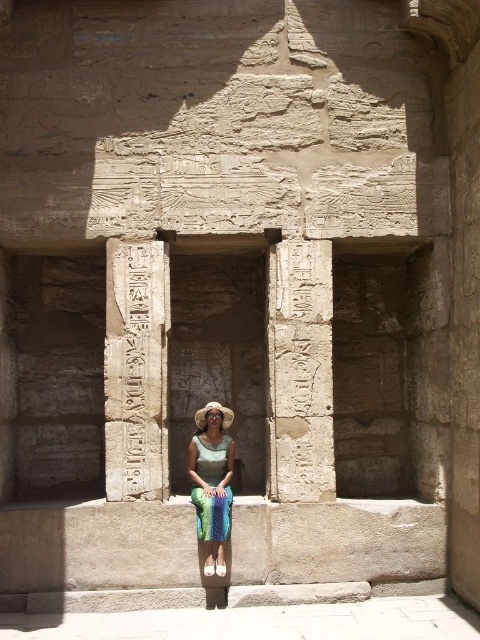
Which is above, white stone hieroglyphics at center or shiny green dress at center?

white stone hieroglyphics at center is above.

The height and width of the screenshot is (640, 480). In order to click on white stone hieroglyphics at center in this screenshot , I will do `click(135, 369)`.

Is carved stone hieroglyphs at center bigger than shiny green dress at center?

Correct, carved stone hieroglyphs at center is larger in size than shiny green dress at center.

Who is more distant from viewer, (316, 310) or (229, 436)?

The point (229, 436) is more distant.

Describe the element at coordinates (300, 372) in the screenshot. I see `carved stone hieroglyphs at center` at that location.

Locate an element on the screen. Image resolution: width=480 pixels, height=640 pixels. carved stone hieroglyphs at center is located at coordinates (300, 372).

Who is higher up, carved stone hieroglyphs at center or white stone hieroglyphics at center?

white stone hieroglyphics at center

Does carved stone hieroglyphs at center appear on the left side of white stone hieroglyphics at center?

No, carved stone hieroglyphs at center is not to the left of white stone hieroglyphics at center.

You are a GUI agent. You are given a task and a screenshot of the screen. Output one action in this format:
    pyautogui.click(x=<x>, y=<y>)
    Task: Click on the carved stone hieroglyphs at center
    
    Given the screenshot: What is the action you would take?
    pyautogui.click(x=300, y=372)

Locate an element on the screen. carved stone hieroglyphs at center is located at coordinates (300, 372).